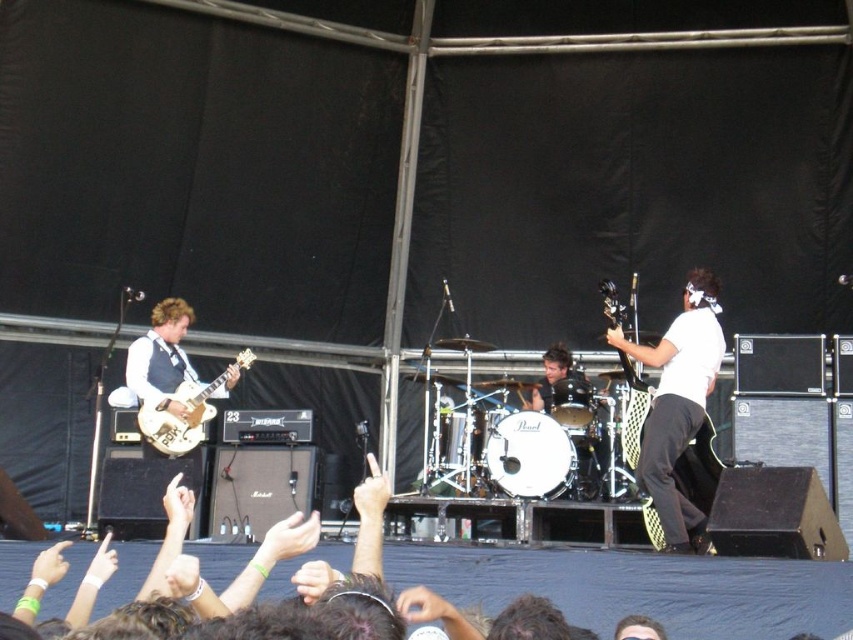
Question: Which point is closer to the camera?

Choices:
 (A) white matte guitar at center
 (B) matte gold electric guitar at left
 (C) matte black electric guitar at right

Answer: (A)

Question: In this image, where is matte gold guitar at left located relative to matte gold electric guitar at left?

Choices:
 (A) below
 (B) above

Answer: (B)

Question: Does white matte guitar at center have a greater width compared to matte black electric guitar at right?

Choices:
 (A) no
 (B) yes

Answer: (B)

Question: Is white matte guitar at center further to camera compared to matte gold guitar at left?

Choices:
 (A) yes
 (B) no

Answer: (B)

Question: Among these objects, which one is farthest from the camera?

Choices:
 (A) white matte guitar at center
 (B) matte gold electric guitar at left
 (C) matte black electric guitar at right

Answer: (B)

Question: Which of these objects is positioned farthest from the matte black electric guitar at right?

Choices:
 (A) matte gold guitar at left
 (B) matte gold electric guitar at left

Answer: (A)